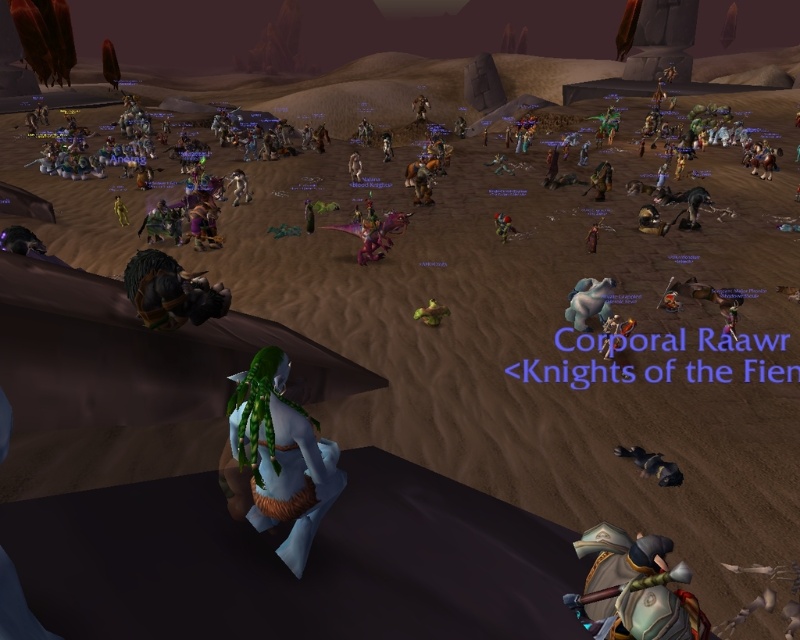
Is shiny silver armor at lower right wider than shiny silver armor at center?

Yes, shiny silver armor at lower right is wider than shiny silver armor at center.

Where is `shiny silver armor at lower right`? The image size is (800, 640). shiny silver armor at lower right is located at coordinates (634, 588).

Who is more forward, (690, 636) or (606, 342)?

Point (690, 636) is in front.

The image size is (800, 640). Identify the location of shiny silver armor at lower right. (634, 588).

Who is positioned more to the left, shiny silver armor at center or green fur at left?

green fur at left is more to the left.

What are the coordinates of `shiny silver armor at center` in the screenshot? It's located at click(x=609, y=333).

Who is more distant from viewer, (612, 337) or (121, 216)?

Point (121, 216)

The image size is (800, 640). Identify the location of shiny silver armor at center. (609, 333).

Between green leather armor at center and shiny silver armor at center, which one is positioned lower?

Positioned lower is shiny silver armor at center.

Between green leather armor at center and shiny silver armor at center, which one has less height?

shiny silver armor at center

The height and width of the screenshot is (640, 800). In order to click on green leather armor at center in this screenshot , I will do `click(601, 179)`.